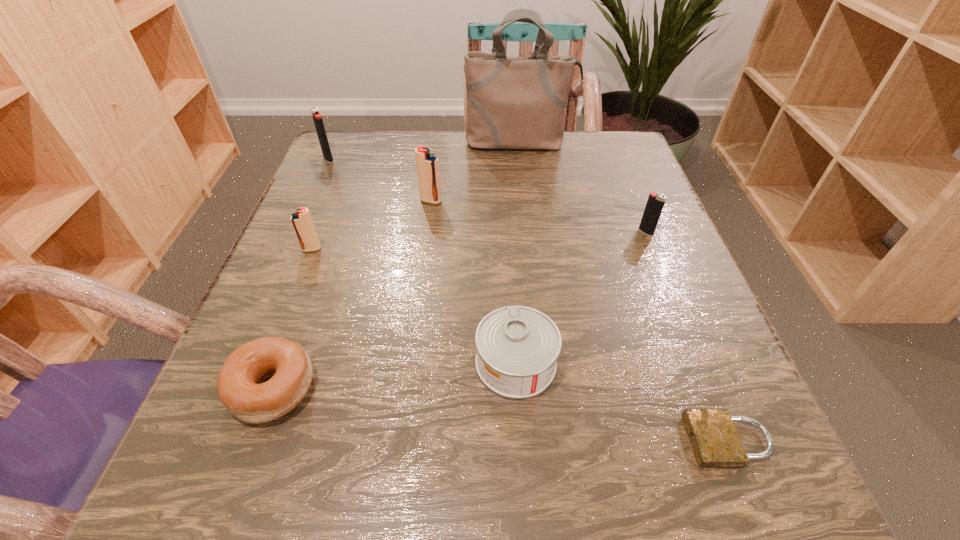
Identify the location of free location located on the keyhole side of the padlock. click(481, 441).

I want to click on free space located on the keyhole side of the padlock, so click(425, 441).

You are a GUI agent. You are given a task and a screenshot of the screen. Output one action in this format:
    pyautogui.click(x=<x>, y=<y>)
    Task: Click on the blank area located 0.220m on the keyhole side of the padlock
    The image size is (960, 540).
    Given the screenshot: What is the action you would take?
    coord(513,441)

What are the coordinates of `shoulder bag that is at the far edge` in the screenshot? It's located at (512, 102).

At what (x,y) coordinates should I click in order to perform the action: click on igniter at the far edge. Please return your answer as a coordinate pair (x, y). Image resolution: width=960 pixels, height=540 pixels. Looking at the image, I should click on (317, 118).

This screenshot has width=960, height=540. What are the coordinates of `object at the near edge` in the screenshot? It's located at (715, 441).

This screenshot has width=960, height=540. In order to click on bagel positioned at the left edge in this screenshot , I will do `click(241, 388)`.

You are a GUI agent. You are given a task and a screenshot of the screen. Output one action in this format:
    pyautogui.click(x=<x>, y=<y>)
    Task: Click on the shoulder bag present at the right edge
    
    Given the screenshot: What is the action you would take?
    pyautogui.click(x=512, y=102)

You are a GUI agent. You are given a task and a screenshot of the screen. Output one action in this format:
    pyautogui.click(x=<x>, y=<y>)
    Task: Click on the igniter at the right edge
    
    Given the screenshot: What is the action you would take?
    pyautogui.click(x=655, y=203)

The image size is (960, 540). In order to click on padlock situated at the right edge in this screenshot , I will do `click(715, 441)`.